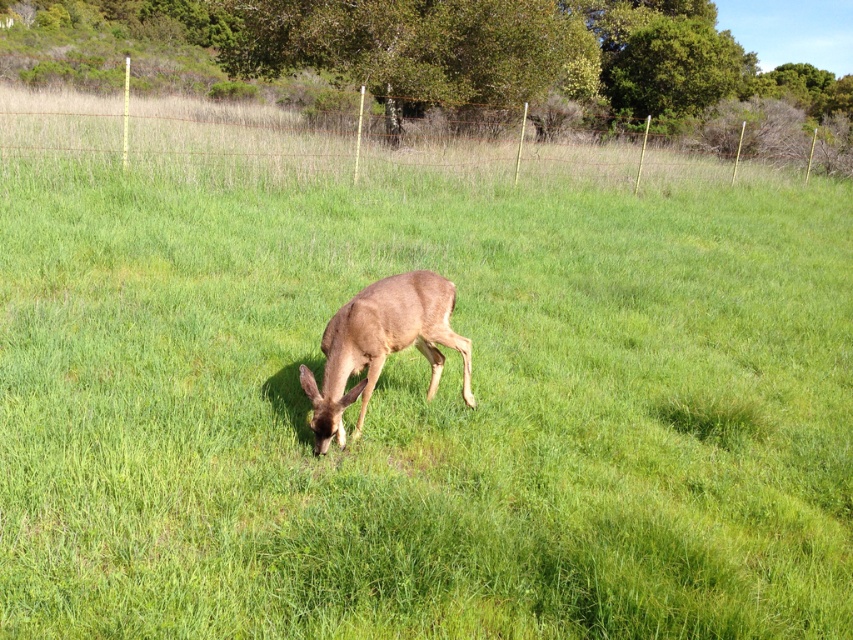
Question: Does brown wire fence at upper center appear on the right side of brown matte deer at center?

Choices:
 (A) yes
 (B) no

Answer: (A)

Question: Among these points, which one is nearest to the camera?

Choices:
 (A) (354, 337)
 (B) (202, 109)

Answer: (A)

Question: Is brown wire fence at upper center positioned before brown matte deer at center?

Choices:
 (A) no
 (B) yes

Answer: (A)

Question: Can you confirm if brown wire fence at upper center is bigger than brown matte deer at center?

Choices:
 (A) yes
 (B) no

Answer: (A)

Question: Which of the following is the closest to the observer?

Choices:
 (A) brown matte deer at center
 (B) brown wire fence at upper center

Answer: (A)